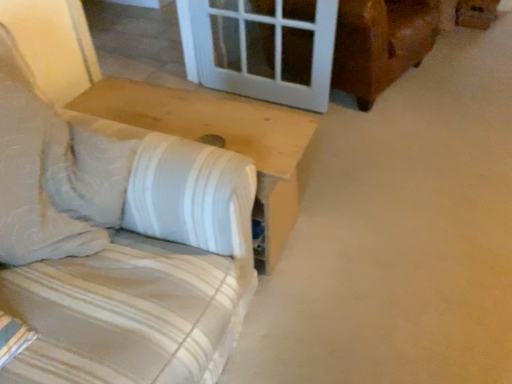
Question: From a real-world perspective, does brown cardboard box at upper right stand above white striped fabric couch at left?

Choices:
 (A) no
 (B) yes

Answer: (A)

Question: Is brown cardboard box at upper right directly adjacent to white striped fabric couch at left?

Choices:
 (A) no
 (B) yes

Answer: (A)

Question: Considering the relative positions of brown cardboard box at upper right and white striped fabric couch at left in the image provided, is brown cardboard box at upper right to the right of white striped fabric couch at left from the viewer's perspective?

Choices:
 (A) yes
 (B) no

Answer: (A)

Question: Is brown cardboard box at upper right to the left of white striped fabric couch at left from the viewer's perspective?

Choices:
 (A) yes
 (B) no

Answer: (B)

Question: Could you tell me if brown cardboard box at upper right is turned towards white striped fabric couch at left?

Choices:
 (A) yes
 (B) no

Answer: (B)

Question: Based on their positions, is white wood table at lower left located to the left or right of white striped fabric couch at left?

Choices:
 (A) left
 (B) right

Answer: (B)

Question: Is point (267, 187) positioned closer to the camera than point (200, 223)?

Choices:
 (A) closer
 (B) farther

Answer: (B)

Question: Would you say white wood table at lower left is inside or outside white striped fabric couch at left?

Choices:
 (A) outside
 (B) inside

Answer: (A)

Question: Is white wood table at lower left wider or thinner than white striped fabric couch at left?

Choices:
 (A) wide
 (B) thin

Answer: (B)

Question: Is point (490, 13) closer or farther from the camera than point (51, 322)?

Choices:
 (A) farther
 (B) closer

Answer: (A)

Question: From the image's perspective, is brown cardboard box at upper right positioned above or below white striped fabric couch at left?

Choices:
 (A) below
 (B) above

Answer: (B)

Question: Is brown cardboard box at upper right taller or shorter than white striped fabric couch at left?

Choices:
 (A) tall
 (B) short

Answer: (B)

Question: From a real-world perspective, is brown cardboard box at upper right positioned above or below white striped fabric couch at left?

Choices:
 (A) below
 (B) above

Answer: (A)

Question: Is point (119, 228) positioned closer to the camera than point (458, 11)?

Choices:
 (A) closer
 (B) farther

Answer: (A)

Question: In terms of size, does white striped fabric couch at left appear bigger or smaller than brown cardboard box at upper right?

Choices:
 (A) small
 (B) big

Answer: (B)